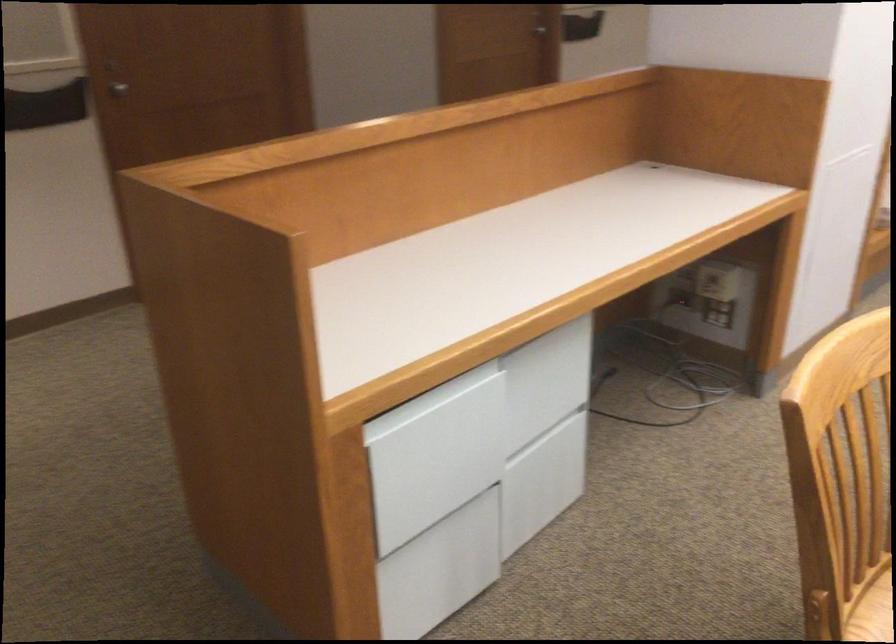
Identify the location of power adapter box. (710, 301).